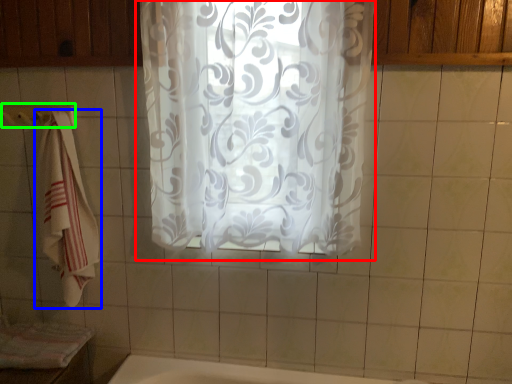
Question: Which object is positioned closest to curtain (highlighted by a red box)? Select from towel (highlighted by a blue box) and towel bar (highlighted by a green box).

Choices:
 (A) towel
 (B) towel bar

Answer: (A)